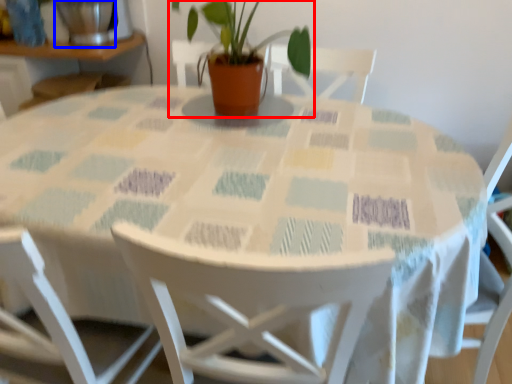
Question: Among these objects, which one is nearest to the camera, houseplant (highlighted by a red box) or glass vase (highlighted by a blue box)?

Choices:
 (A) houseplant
 (B) glass vase

Answer: (A)